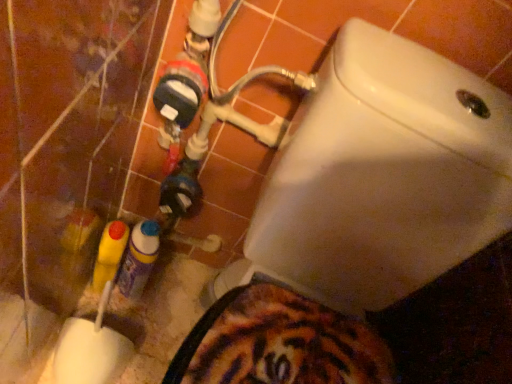
Question: Relative to translucent plastic spray can at lower left, the second bottle positioned from the left, is white glossy toilet at upper right in front or behind?

Choices:
 (A) front
 (B) behind

Answer: (A)

Question: Looking at the image, does white glossy toilet at upper right seem bigger or smaller compared to translucent plastic spray can at lower left, acting as the 1th bottle starting from the right?

Choices:
 (A) big
 (B) small

Answer: (A)

Question: Which of these objects is positioned farthest from the white glossy toilet at upper right?

Choices:
 (A) yellow plastic bottle at lower left, the 1th bottle in the left-to-right sequence
 (B) translucent plastic spray can at lower left, acting as the 1th bottle starting from the right

Answer: (A)

Question: Which is nearer to the yellow plastic bottle at lower left, the second bottle when ordered from right to left?

Choices:
 (A) white glossy toilet at upper right
 (B) translucent plastic spray can at lower left, acting as the 1th bottle starting from the right

Answer: (B)